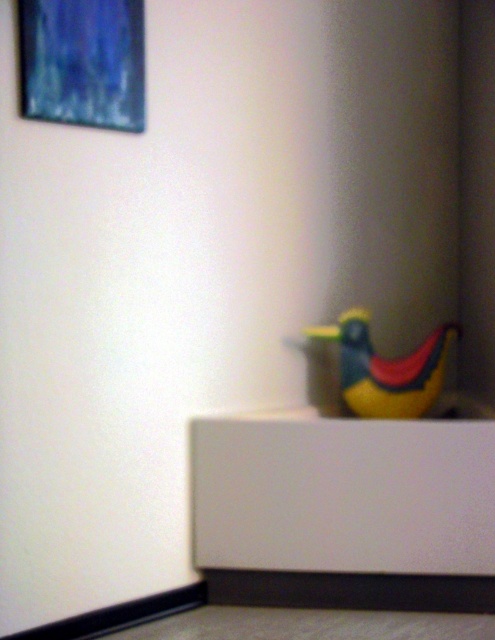
Question: Which point is farther to the camera?

Choices:
 (A) (367, 349)
 (B) (44, 12)

Answer: (A)

Question: Which of the following is the closest to the observer?

Choices:
 (A) yellow rubber duck at lower right
 (B) blue textured canvas at upper left

Answer: (B)

Question: Among these points, which one is nearest to the camera?

Choices:
 (A) (383, 406)
 (B) (55, 68)

Answer: (B)

Question: Does blue textured canvas at upper left appear under yellow rubber duck at lower right?

Choices:
 (A) no
 (B) yes

Answer: (A)

Question: Does blue textured canvas at upper left have a smaller size compared to yellow rubber duck at lower right?

Choices:
 (A) yes
 (B) no

Answer: (A)

Question: Is blue textured canvas at upper left in front of yellow rubber duck at lower right?

Choices:
 (A) no
 (B) yes

Answer: (B)